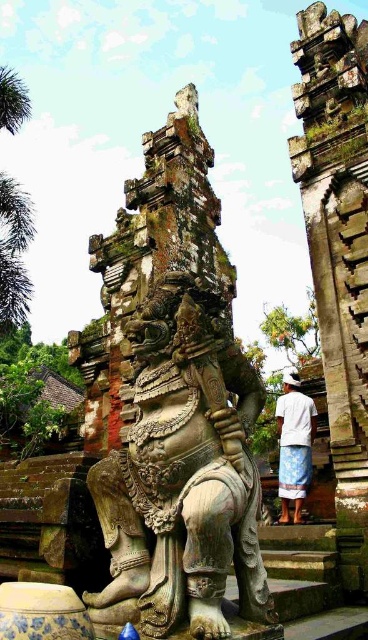
You are standing in front of the Balinese temple and want to take a photo that includes both the central statue and the person near the steps. Which of the two points, point (310, 198) or point (9, 211), is closer to you to ensure both subjects are in focus?

Point (310, 198) is closer to the viewer than point (9, 211), so focusing on that point will help ensure both the statue and the person are in focus.

You are planning to take a photo of the carved stone pillar at right and the green leafy palm tree at upper left from the temple steps. Which object will appear wider in the photo?

The green leafy palm tree at upper left will appear wider in the photo because the carved stone pillar at right has a lesser width compared to it.

You are a tourist visiting the temple and want to take a photo of the carved stone pillar at right and the white woven cloth at center. Which object should you focus on first to ensure both are in the frame without moving the camera?

You should focus on the carved stone pillar at right first because it is closer to the viewer than the white woven cloth at center, so adjusting the focus to the closer object will help keep both in the frame.